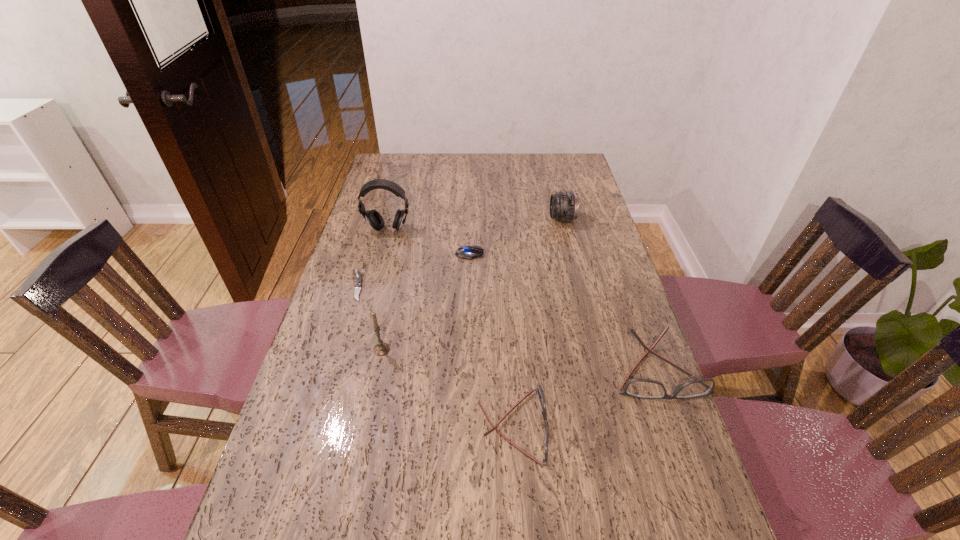
Identify the location of vacant place for an extra spectacles on the left. (330, 501).